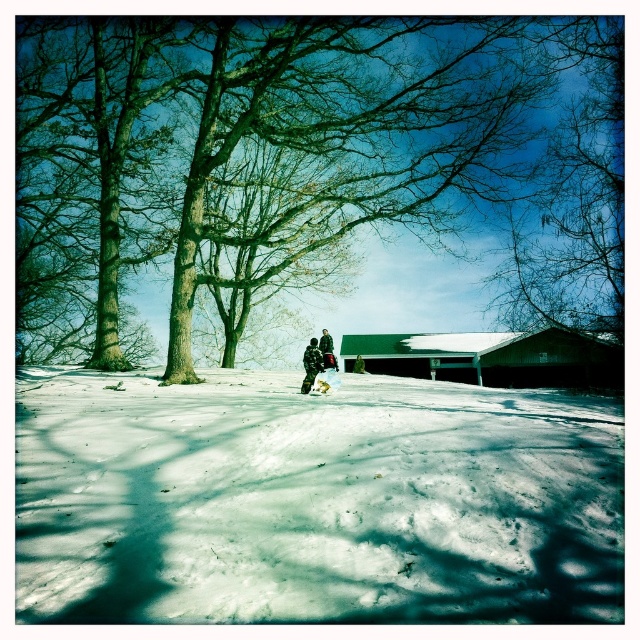
Can you confirm if green bark tree at center is positioned above snowy camouflage jacket at center?

Indeed, green bark tree at center is positioned over snowy camouflage jacket at center.

Does green bark tree at center come behind snowy camouflage jacket at center?

No, green bark tree at center is closer to the viewer.

Identify the location of green bark tree at center. (259, 138).

This screenshot has width=640, height=640. I want to click on green bark tree at center, so click(259, 138).

Looking at this image, does green bark tree at center come in front of white matte snowboard at center?

Yes, it is in front of white matte snowboard at center.

This screenshot has height=640, width=640. I want to click on green bark tree at center, so click(259, 138).

You are a GUI agent. You are given a task and a screenshot of the screen. Output one action in this format:
    pyautogui.click(x=<x>, y=<y>)
    Task: Click on the green bark tree at center
    The width and height of the screenshot is (640, 640).
    Given the screenshot: What is the action you would take?
    pyautogui.click(x=259, y=138)

Can you confirm if white powdery snow at center is positioned above green bark tree at center?

No.

Is point (51, 593) farther from viewer compared to point (264, 24)?

No, (51, 593) is closer to viewer.

Where is `white powdery snow at center`? This screenshot has height=640, width=640. white powdery snow at center is located at coordinates (314, 500).